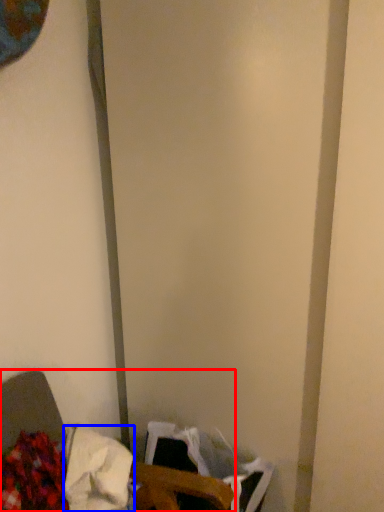
Question: Which of the following is the closest to the observer, furniture (highlighted by a red box) or waste (highlighted by a blue box)?

Choices:
 (A) furniture
 (B) waste

Answer: (A)